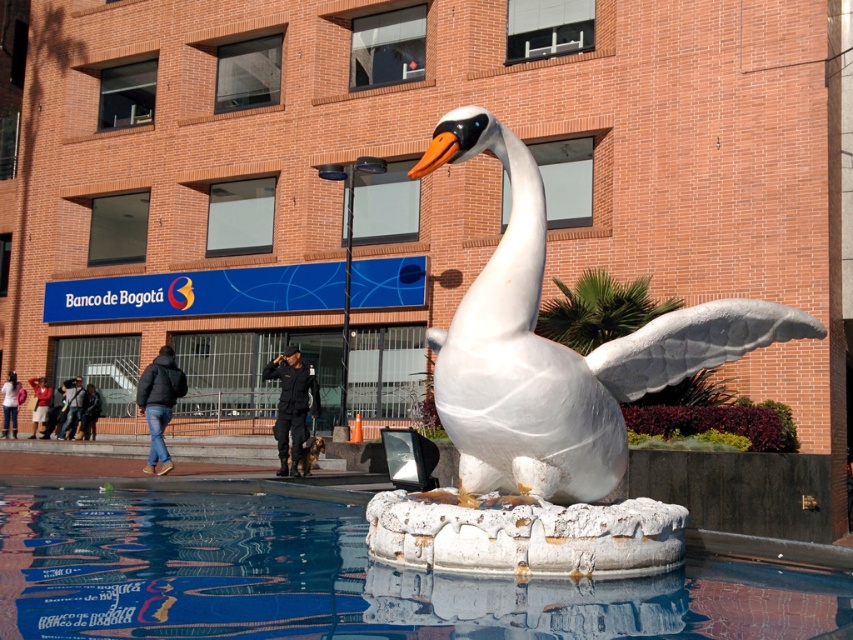
You are standing in front of the white marble swan at center and want to move towards the white stone pool at center. In which direction should you walk?

You should walk to your left because the white stone pool at center is located to the left of the white marble swan at center.

You are a maintenance worker tasked with cleaning the white stone pool at center and the white marble swan at center. Your cleaning equipment has a 1.0 meter reach. Can you clean both objects without moving your position?

The distance between the white stone pool at center and the white marble swan at center is 1.10 meters. Since your equipment only reaches 1.0 meters, you cannot reach both objects without moving your position.

You are a city planner assessing the urban space. You notice the white stone pool at center and the white marble swan at center. Which object occupies a larger area in the scene?

The white marble swan at center is larger than the white stone pool at center, so it occupies a larger area in the scene.